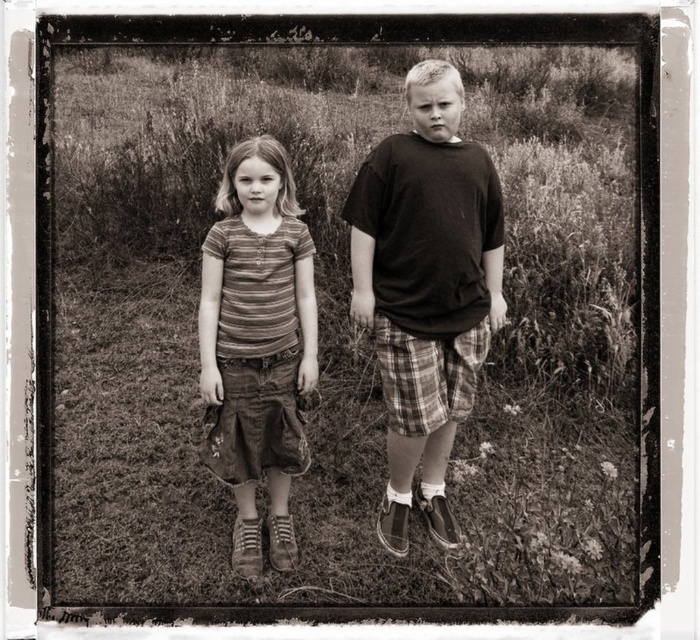
Is grassy field at center thinner than striped cotton shirt at center?

No, grassy field at center is not thinner than striped cotton shirt at center.

Does grassy field at center have a smaller size compared to striped cotton shirt at center?

Actually, grassy field at center might be larger than striped cotton shirt at center.

You are a GUI agent. You are given a task and a screenshot of the screen. Output one action in this format:
    pyautogui.click(x=<x>, y=<y>)
    Task: Click on the grassy field at center
    This screenshot has width=700, height=640.
    Given the screenshot: What is the action you would take?
    pyautogui.click(x=349, y=321)

Who is positioned more to the left, grassy field at center or dark brown cotton shirt at center?

grassy field at center is more to the left.

Is grassy field at center smaller than dark brown cotton shirt at center?

No, grassy field at center is not smaller than dark brown cotton shirt at center.

What do you see at coordinates (349, 321) in the screenshot? The height and width of the screenshot is (640, 700). I see `grassy field at center` at bounding box center [349, 321].

Where is `grassy field at center`? grassy field at center is located at coordinates (349, 321).

Does dark brown cotton shirt at center have a larger size compared to striped cotton shirt at center?

Yes.

Which is in front, point (444, 420) or point (225, 291)?

Positioned in front is point (225, 291).

Locate an element on the screen. This screenshot has width=700, height=640. dark brown cotton shirt at center is located at coordinates (426, 288).

Identify the location of dark brown cotton shirt at center. The width and height of the screenshot is (700, 640). (426, 288).